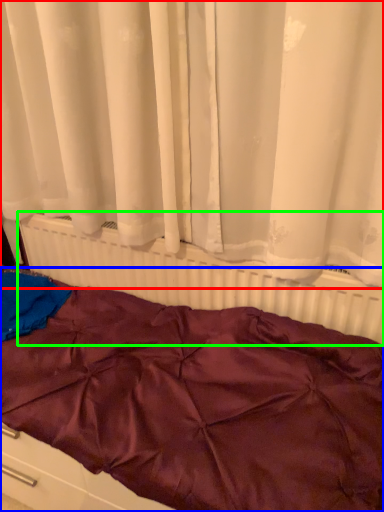
Question: Based on their relative distances, which object is farther from curtain (highlighted by a red box)? Choose from furniture (highlighted by a blue box) and radiator (highlighted by a green box).

Choices:
 (A) furniture
 (B) radiator

Answer: (A)